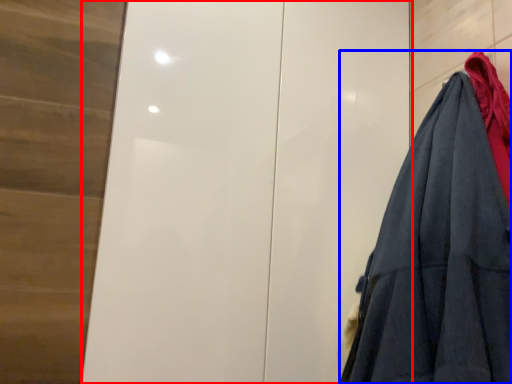
Question: Among these objects, which one is farthest to the camera, door (highlighted by a red box) or garment (highlighted by a blue box)?

Choices:
 (A) door
 (B) garment

Answer: (A)